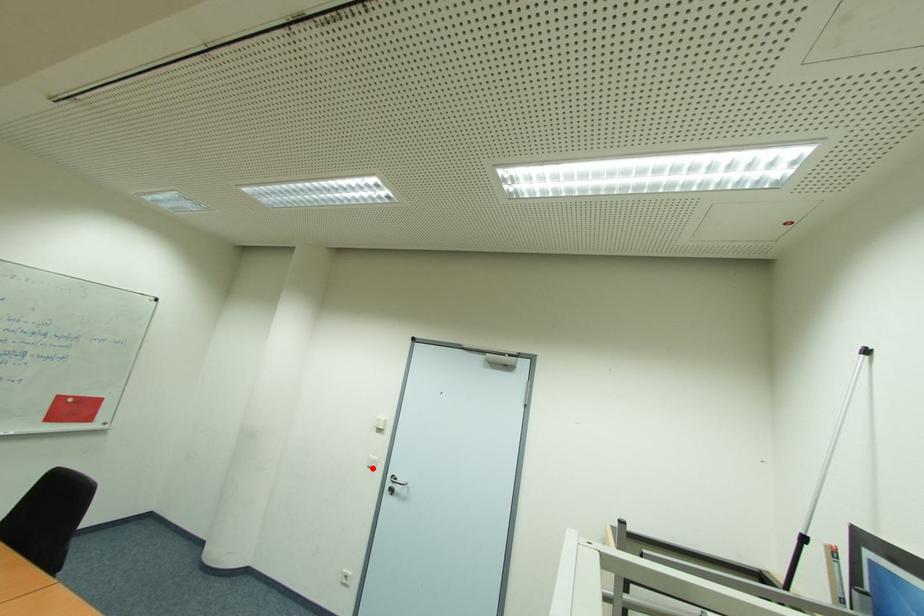
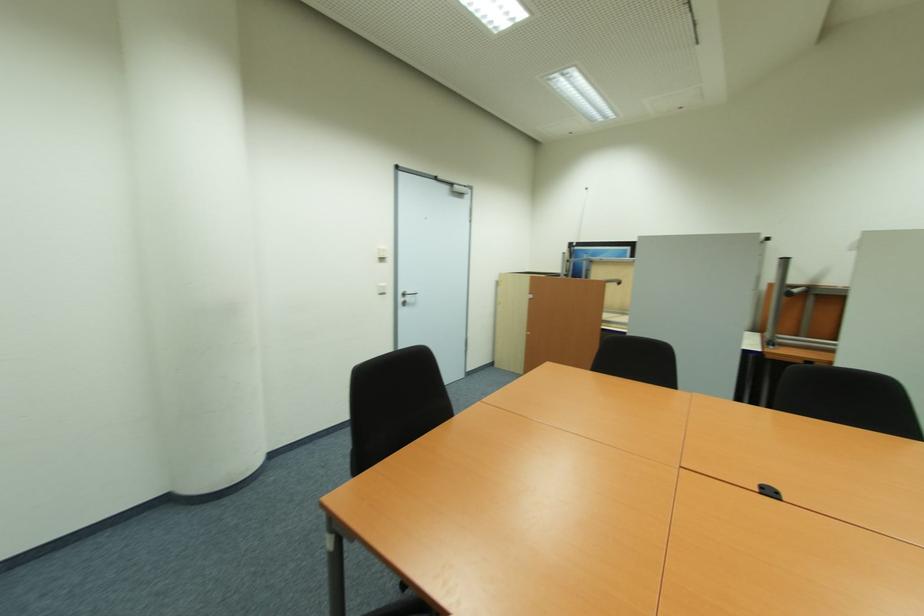
Question: I am providing you with two images of the same scene from different viewpoints. Image1 has a red point marked. In image2, the corresponding 3D location appears at what relative position? Reply with the corresponding letter.

Choices:
 (A) Closer
 (B) Farther

Answer: (A)